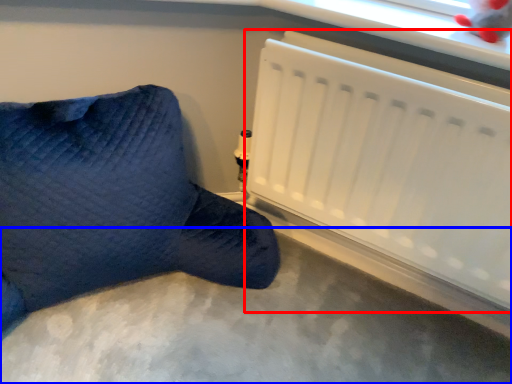
Question: Which point is closer to the camera, radiator (highlighted by a red box) or concrete (highlighted by a blue box)?

Choices:
 (A) radiator
 (B) concrete

Answer: (B)